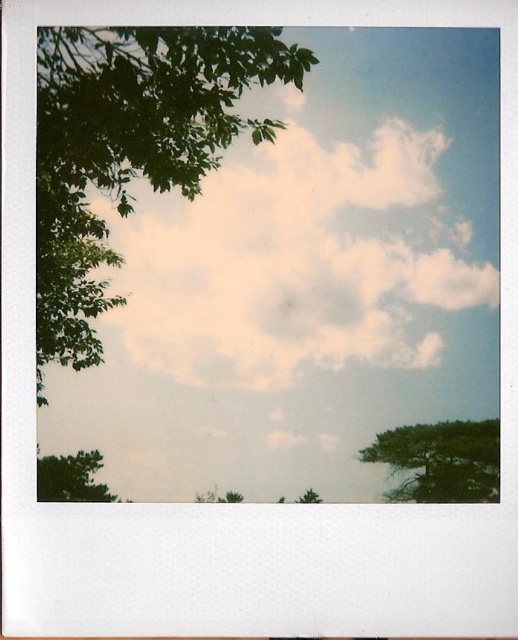
You are a photographer trying to capture a closeup of both the green matte tree at lower right and the green leafy tree at lower center in the scene. Given that your camera can only focus on objects within a 10 inch range, will you be able to capture both trees in focus?

The green matte tree at lower right and the green leafy tree at lower center are 10.92 inches apart from each other. Since the distance between them exceeds the camera focus range of 10 inches, you will not be able to capture both trees in focus simultaneously.

You are standing in a park and see the green matte tree at lower right. If you want to walk directly towards the tree from your current position, which direction should you face?

To walk directly towards the green matte tree at lower right, you should face the lower right direction since that is where the tree is located.

You are an artist planning to paint this scene. You have a limited amount of green paint. Given that the green matte tree at lower right and the green matte tree at lower left need to be painted, which tree requires more green paint based on their sizes?

The green matte tree at lower right requires more green paint because its width is larger than the green matte tree at lower left.